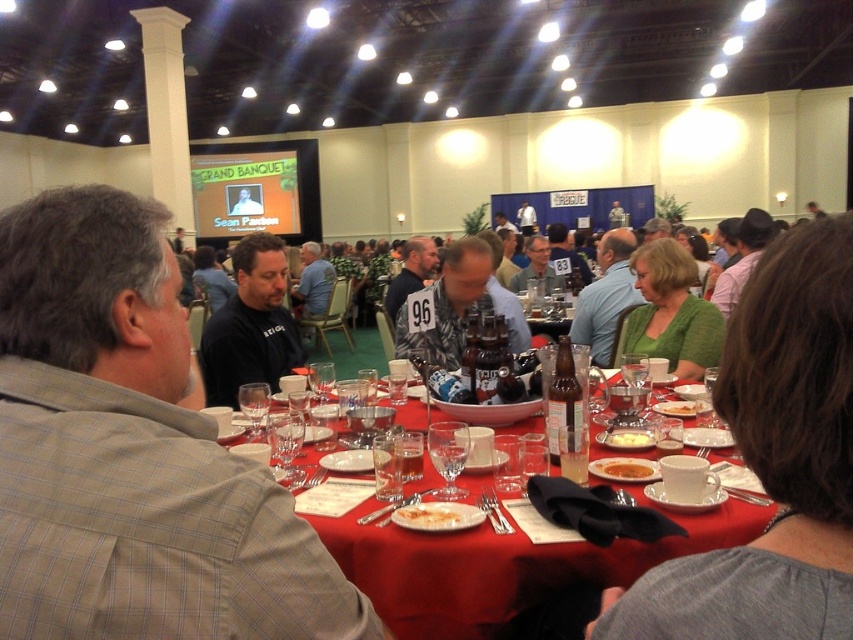
The image size is (853, 640). Describe the element at coordinates (671, 310) in the screenshot. I see `green knitted sweater at center` at that location.

Is point (646, 275) closer to viewer compared to point (473, 300)?

That is False.

This screenshot has height=640, width=853. I want to click on green knitted sweater at center, so click(671, 310).

Who is positioned more to the right, green knitted sweater at center or yellowish matte bread at center?

green knitted sweater at center is more to the right.

Is green knitted sweater at center bigger than yellowish matte bread at center?

Indeed, green knitted sweater at center has a larger size compared to yellowish matte bread at center.

Does point (683, 374) lie in front of point (610, 468)?

That is False.

At what (x,y) coordinates should I click in order to perform the action: click on green knitted sweater at center. Please return your answer as a coordinate pair (x, y). The height and width of the screenshot is (640, 853). Looking at the image, I should click on (671, 310).

Who is lower down, green knitwear at center or white creamy food at center?

white creamy food at center

Between point (776, 275) and point (451, 513), which one is positioned in front?

Point (776, 275) is more forward.

In order to click on green knitwear at center in this screenshot , I will do `click(773, 461)`.